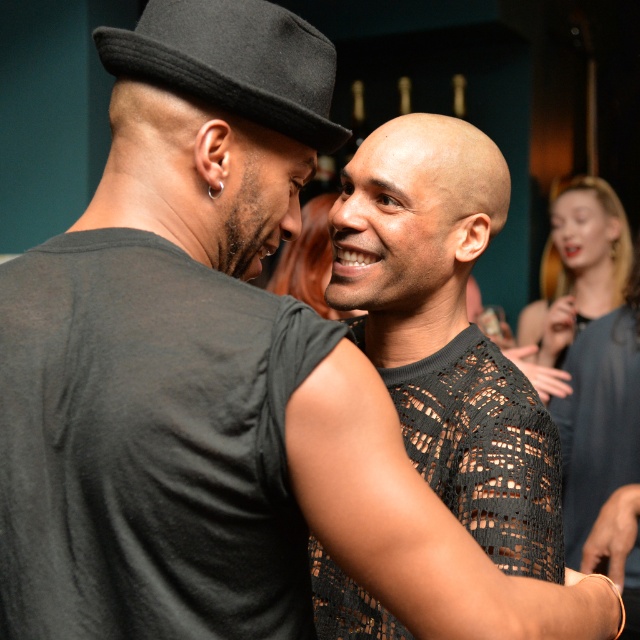
Question: From the image, what is the correct spatial relationship of bald head at center in relation to blonde hair at upper right?

Choices:
 (A) above
 (B) below

Answer: (B)

Question: Is black mesh shirt at center thinner than black felt fedora at upper left?

Choices:
 (A) yes
 (B) no

Answer: (B)

Question: Which object is closer to the camera taking this photo?

Choices:
 (A) smooth blonde hair at center
 (B) black mesh shirt at center
 (C) bald head at center
 (D) smooth gray dress at upper right

Answer: (B)

Question: Among these objects, which one is nearest to the camera?

Choices:
 (A) bald head at center
 (B) blonde hair at upper right

Answer: (A)

Question: Does bald head at center have a smaller size compared to smooth blonde hair at center?

Choices:
 (A) no
 (B) yes

Answer: (B)

Question: Among these objects, which one is farthest from the camera?

Choices:
 (A) black mesh shirt at center
 (B) blonde hair at upper right

Answer: (B)